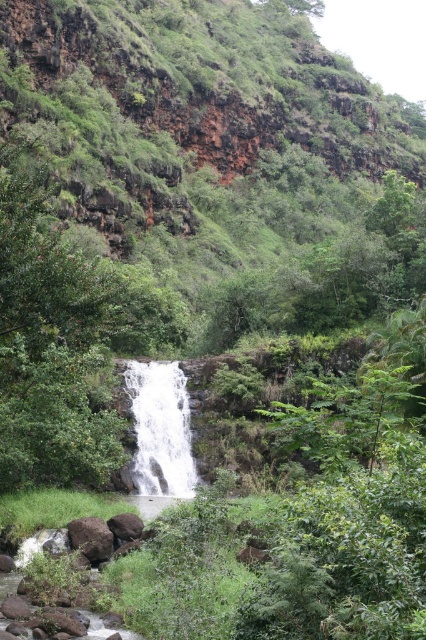
You are a hiker trying to determine the best path to reach the waterfall. You notice the green mossy hillside at upper center and the smooth brown rock at lower left. Which of these two features is taller, and how might that affect your route?

The green mossy hillside at upper center is taller than the smooth brown rock at lower left. This means the hillside may present a steeper or more challenging climb, so choosing the path near the smooth brown rock at lower left might be easier for reaching the waterfall.

You are a hiker standing at the base of the cliff looking up at the waterfall. You notice the white frothy water at center and the brown rough rock at lower center. Which one appears wider from your perspective?

The white frothy water at center appears wider than the brown rough rock at lower center because its width is larger according to the description.